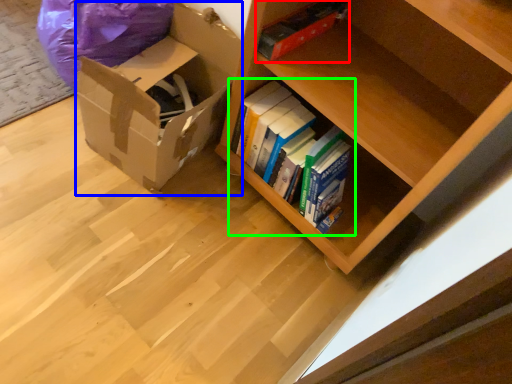
Question: Based on their relative distances, which object is farther from paperback book (highlighted by a red box)? Choose from cardboard box (highlighted by a blue box) and book (highlighted by a green box).

Choices:
 (A) cardboard box
 (B) book

Answer: (A)